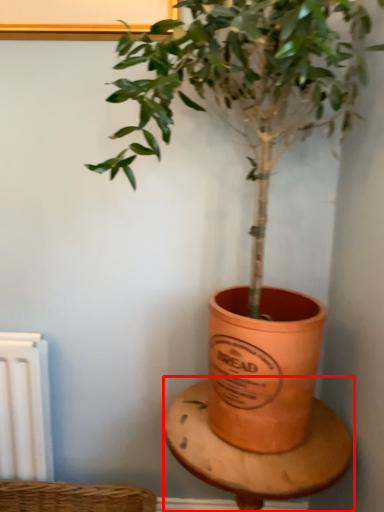
Question: From the image's perspective, what is the correct spatial positioning of table (annotated by the red box) in reference to houseplant?

Choices:
 (A) above
 (B) below

Answer: (B)